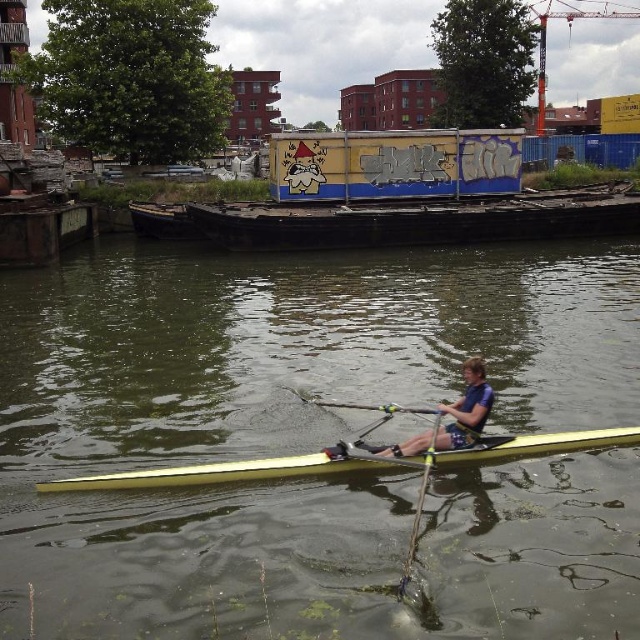
You are a safety inspector checking the rowing boat. You notice the blue fabric life vest at center and the yellow wood paddle at center. According to safety regulations, the life vest must be easily accessible and not obstructed by any equipment. Is the current arrangement compliant with this rule?

The blue fabric life vest at center is in front of the yellow wood paddle at center, meaning it is not obstructed and is easily accessible, so the arrangement is compliant with safety regulations.

Based on the photo, you are a safety inspector checking the rowing boat setup. The greenish murky water at center and the blue fabric life vest at center are both present. According to safety regulations, the life vest must be visible and accessible. Is the current arrangement compliant?

The greenish murky water at center is above the blue fabric life vest at center, which means the life vest is submerged underwater and not visible or accessible. This violates safety regulations as the life vest must be easily reachable and visible.